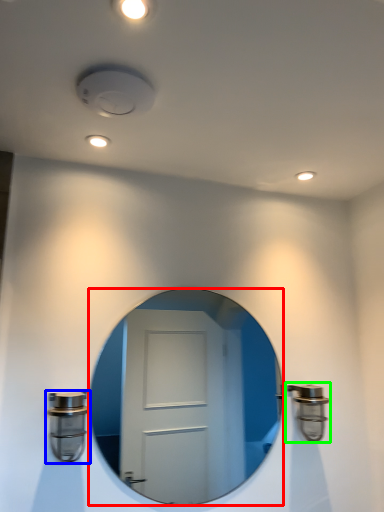
Question: Considering the real-world distances, which object is farthest from mirror (highlighted by a red box)? door handle (highlighted by a blue box) or door handle (highlighted by a green box)?

Choices:
 (A) door handle
 (B) door handle

Answer: (A)